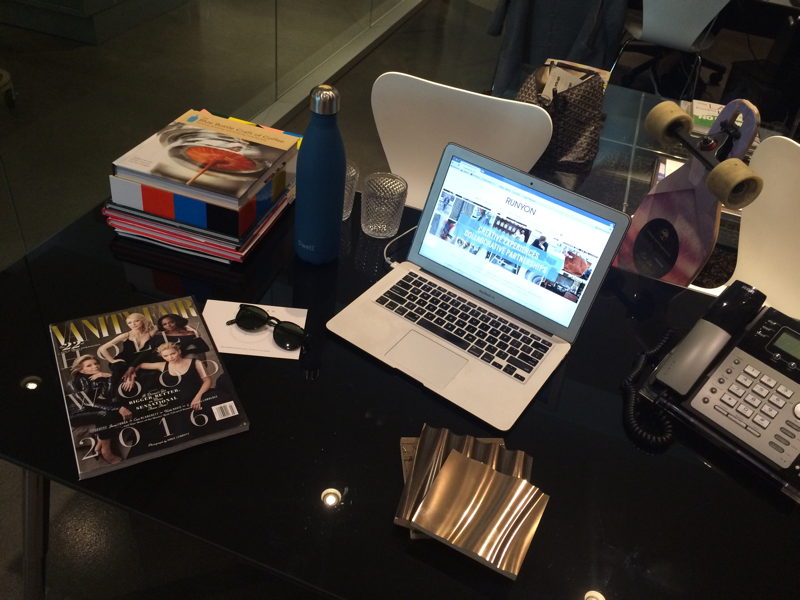
Image resolution: width=800 pixels, height=600 pixels. Identify the location of desk. (614, 492).